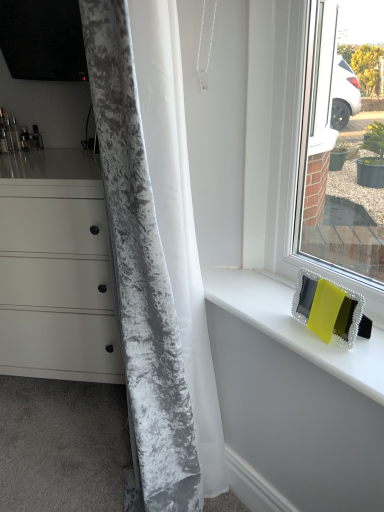
Question: From a real-world perspective, is matte white chest of drawers at left positioned above or below yellow fabric at upper right?

Choices:
 (A) above
 (B) below

Answer: (B)

Question: Is matte white chest of drawers at left in front of or behind yellow fabric at upper right in the image?

Choices:
 (A) front
 (B) behind

Answer: (B)

Question: Estimate the real-world distances between objects in this image. Which object is closer to the velvet gray curtain at left?

Choices:
 (A) yellow fabric at upper right
 (B) matte white chest of drawers at left
 (C) matte yellow frame at right

Answer: (A)

Question: Which of these objects is positioned farthest from the velvet gray curtain at left?

Choices:
 (A) yellow fabric at upper right
 (B) matte white chest of drawers at left
 (C) matte yellow frame at right

Answer: (B)